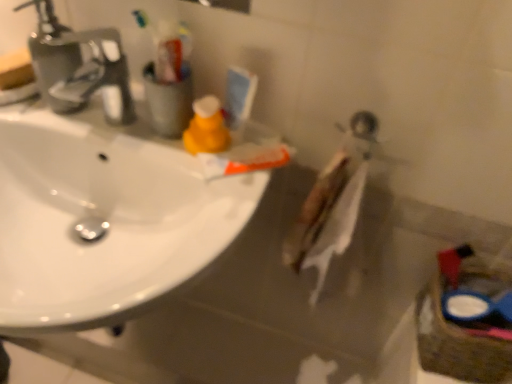
Question: Considering the relative sizes of white matte toothpaste at center and matte orange spray bottle at upper center in the image provided, is white matte toothpaste at center taller than matte orange spray bottle at upper center?

Choices:
 (A) yes
 (B) no

Answer: (B)

Question: From the image's perspective, is white matte toothpaste at center beneath matte orange spray bottle at upper center?

Choices:
 (A) no
 (B) yes

Answer: (B)

Question: Is white matte toothpaste at center positioned far away from matte orange spray bottle at upper center?

Choices:
 (A) yes
 (B) no

Answer: (B)

Question: Does white matte toothpaste at center have a lesser height compared to matte orange spray bottle at upper center?

Choices:
 (A) no
 (B) yes

Answer: (B)

Question: Does white matte toothpaste at center have a smaller size compared to matte orange spray bottle at upper center?

Choices:
 (A) no
 (B) yes

Answer: (A)

Question: Is point (195, 130) closer or farther from the camera than point (207, 162)?

Choices:
 (A) farther
 (B) closer

Answer: (A)

Question: Considering their positions, is matte orange spray bottle at upper center located in front of or behind white matte toothpaste at center?

Choices:
 (A) front
 (B) behind

Answer: (A)

Question: Looking at their shapes, would you say matte orange spray bottle at upper center is wider or thinner than white matte toothpaste at center?

Choices:
 (A) thin
 (B) wide

Answer: (A)

Question: Based on their positions, is matte orange spray bottle at upper center located to the left or right of white matte toothpaste at center?

Choices:
 (A) left
 (B) right

Answer: (A)

Question: Is blue plastic basket at lower right bigger or smaller than matte orange spray bottle at upper center?

Choices:
 (A) small
 (B) big

Answer: (B)

Question: From a real-world perspective, is blue plastic basket at lower right physically located above or below matte orange spray bottle at upper center?

Choices:
 (A) above
 (B) below

Answer: (B)

Question: Looking at their shapes, would you say blue plastic basket at lower right is wider or thinner than matte orange spray bottle at upper center?

Choices:
 (A) wide
 (B) thin

Answer: (A)

Question: Is blue plastic basket at lower right taller or shorter than matte orange spray bottle at upper center?

Choices:
 (A) tall
 (B) short

Answer: (A)

Question: From the image's perspective, is blue plastic basket at lower right positioned above or below white glossy sink at upper left?

Choices:
 (A) above
 (B) below

Answer: (B)

Question: Relative to white glossy sink at upper left, is blue plastic basket at lower right in front or behind?

Choices:
 (A) front
 (B) behind

Answer: (B)